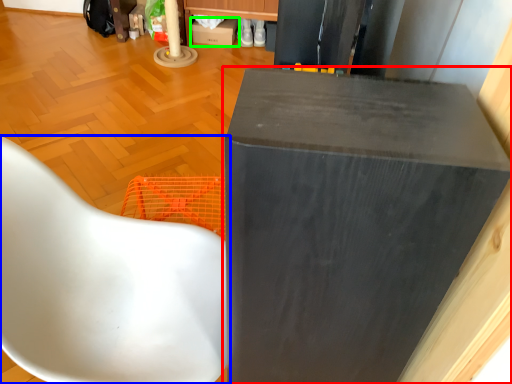
Question: Considering the real-world distances, which object is closest to furniture (highlighted by a red box)? chair (highlighted by a blue box) or cardboard box (highlighted by a green box).

Choices:
 (A) chair
 (B) cardboard box

Answer: (A)